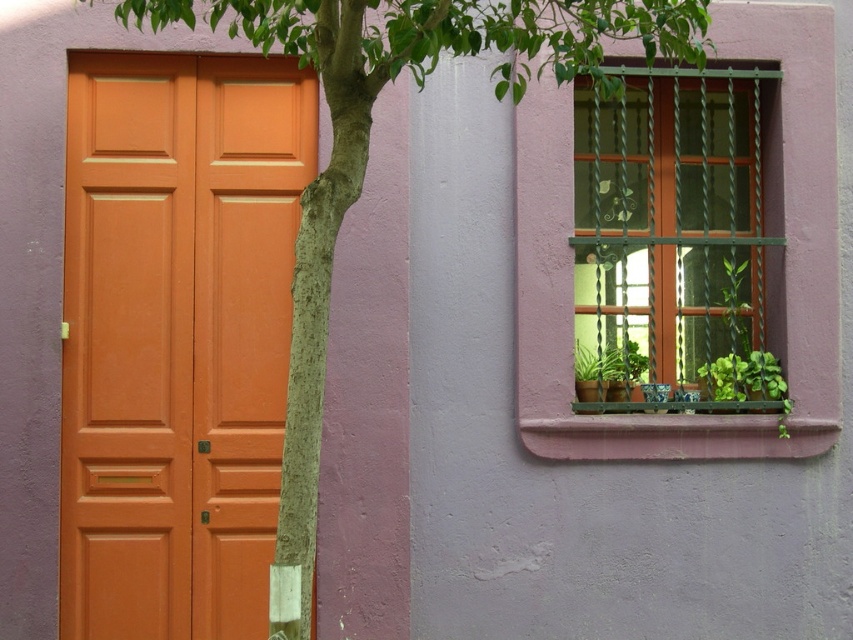
You are a painter standing 2 meters away from the matte orange door at left. You want to paint the green metal bars at upper right without moving closer. Can you reach them with a 2.1 meter long paintbrush?

The distance between the matte orange door at left and the green metal bars at upper right is 1.95 meters. Since your paintbrush is 2.1 meters long, which is longer than the distance between them, you can reach the green metal bars at upper right without moving closer.